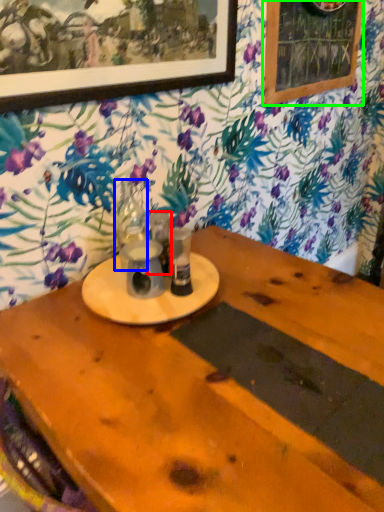
Question: Estimate the real-world distances between objects in this image. Which object is closer to tableware (highlighted by a red box), tableware (highlighted by a blue box) or bulletin board (highlighted by a green box)?

Choices:
 (A) tableware
 (B) bulletin board

Answer: (A)